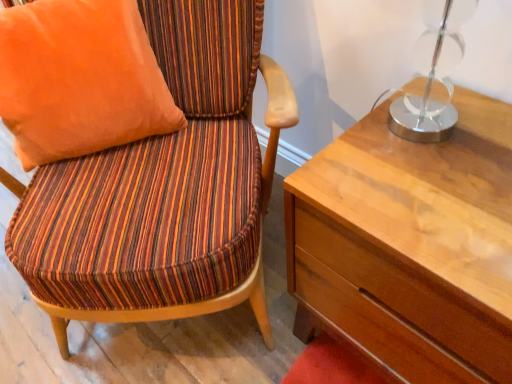
Image resolution: width=512 pixels, height=384 pixels. What do you see at coordinates (164, 188) in the screenshot? I see `striped fabric chair at left` at bounding box center [164, 188].

At what (x,y) coordinates should I click in order to perform the action: click on striped fabric chair at left. Please return your answer as a coordinate pair (x, y). Looking at the image, I should click on (164, 188).

Locate an element on the screen. Image resolution: width=512 pixels, height=384 pixels. orange fabric pillow at upper left is located at coordinates (79, 79).

From the picture: In order to face orange fabric pillow at upper left, should I rotate leftwards or rightwards?

To face it directly, rotate left by 23.414 degrees.

What do you see at coordinates (79, 79) in the screenshot?
I see `orange fabric pillow at upper left` at bounding box center [79, 79].

What is the approximate height of orange fabric pillow at upper left?

It is 19.62 inches.

I want to click on striped fabric chair at left, so click(164, 188).

Considering the positions of objects orange fabric pillow at upper left and striped fabric chair at left in the image provided, who is more to the left, orange fabric pillow at upper left or striped fabric chair at left?

orange fabric pillow at upper left.

Which object is closer to the camera taking this photo, orange fabric pillow at upper left or striped fabric chair at left?

striped fabric chair at left is more forward.

Considering the points (31, 138) and (209, 25), which point is behind, point (31, 138) or point (209, 25)?

Positioned behind is point (209, 25).

From the image's perspective, which object appears higher, orange fabric pillow at upper left or striped fabric chair at left?

orange fabric pillow at upper left appears higher in the image.

From a real-world perspective, between orange fabric pillow at upper left and striped fabric chair at left, who is vertically higher?

From a 3D spatial view, orange fabric pillow at upper left is above.

Between orange fabric pillow at upper left and striped fabric chair at left, which one has larger width?

striped fabric chair at left is wider.

Can you confirm if orange fabric pillow at upper left is taller than striped fabric chair at left?

No, orange fabric pillow at upper left is not taller than striped fabric chair at left.

Looking at the image, does orange fabric pillow at upper left seem bigger or smaller compared to striped fabric chair at left?

Considering their sizes, orange fabric pillow at upper left takes up less space than striped fabric chair at left.

Is striped fabric chair at left a part of orange fabric pillow at upper left?

No, striped fabric chair at left is not inside orange fabric pillow at upper left.

Looking at this image, is orange fabric pillow at upper left not close to striped fabric chair at left?

orange fabric pillow at upper left is near striped fabric chair at left, not far away.

Does orange fabric pillow at upper left turn towards striped fabric chair at left?

Yes, orange fabric pillow at upper left faces towards striped fabric chair at left.

How many degrees apart are the facing directions of orange fabric pillow at upper left and striped fabric chair at left?

The facing directions of orange fabric pillow at upper left and striped fabric chair at left are 8.68 degrees apart.

Identify the location of chair that appears in front of the orange fabric pillow at upper left. (164, 188).

Does striped fabric chair at left appear on the left side of orange fabric pillow at upper left?

No.

Between striped fabric chair at left and orange fabric pillow at upper left, which one is positioned behind?

orange fabric pillow at upper left is further from the camera.

Is point (19, 245) more distant than point (15, 94)?

No, (19, 245) is in front of (15, 94).

From the image's perspective, which one is positioned lower, striped fabric chair at left or orange fabric pillow at upper left?

striped fabric chair at left appears lower in the image.

From a real-world perspective, is striped fabric chair at left positioned over orange fabric pillow at upper left based on gravity?

No, from a real-world perspective, striped fabric chair at left is not above orange fabric pillow at upper left.

Considering the sizes of objects striped fabric chair at left and orange fabric pillow at upper left in the image provided, who is thinner, striped fabric chair at left or orange fabric pillow at upper left?

Thinner between the two is orange fabric pillow at upper left.

Can you confirm if striped fabric chair at left is shorter than orange fabric pillow at upper left?

No.

Is striped fabric chair at left bigger or smaller than orange fabric pillow at upper left?

In the image, striped fabric chair at left appears to be larger than orange fabric pillow at upper left.

Looking at this image, can we say striped fabric chair at left lies outside orange fabric pillow at upper left?

Absolutely, striped fabric chair at left is external to orange fabric pillow at upper left.

Looking at this image, would you say striped fabric chair at left is a long distance from orange fabric pillow at upper left?

No, there isn't a large distance between striped fabric chair at left and orange fabric pillow at upper left.

Could you tell me if striped fabric chair at left is facing orange fabric pillow at upper left?

Yes, striped fabric chair at left is facing orange fabric pillow at upper left.

How many degrees apart are the facing directions of striped fabric chair at left and orange fabric pillow at upper left?

The facing directions of striped fabric chair at left and orange fabric pillow at upper left are 8.68 degrees apart.

You are a GUI agent. You are given a task and a screenshot of the screen. Output one action in this format:
    pyautogui.click(x=<x>, y=<y>)
    Task: Click on the chair below the orange fabric pillow at upper left (from the image's perspective)
    
    Given the screenshot: What is the action you would take?
    pyautogui.click(x=164, y=188)

The height and width of the screenshot is (384, 512). Find the location of `chair that appears in front of the orange fabric pillow at upper left`. chair that appears in front of the orange fabric pillow at upper left is located at coordinates (164, 188).

This screenshot has height=384, width=512. I want to click on chair on the right of orange fabric pillow at upper left, so click(x=164, y=188).